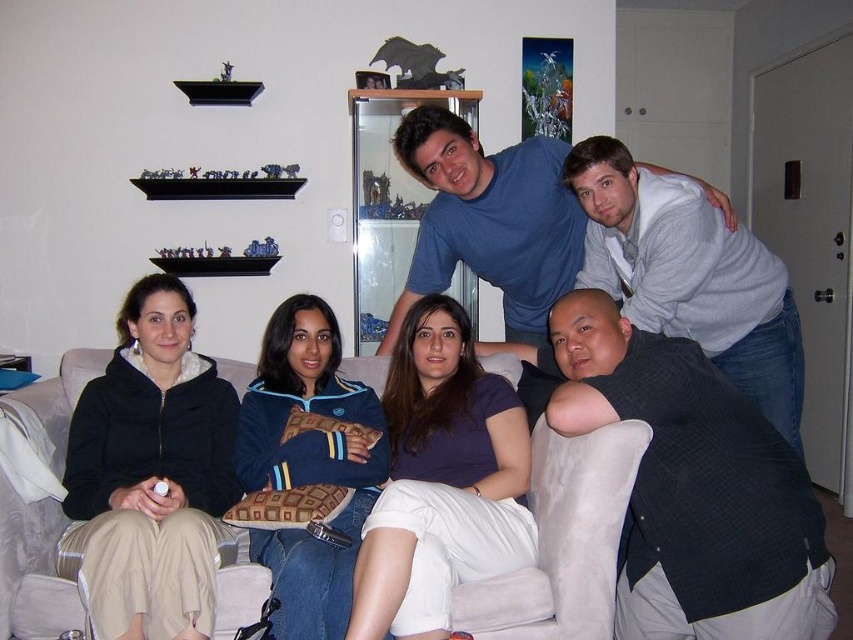
In the scene shown: What is the location of the point with coordinates (689, 275) in the image?

The point with coordinates (689, 275) is located on the gray sweater at upper right.

You are standing in the living room and want to take a photo of the two points. Which point, point (x=665, y=321) or point (x=431, y=260), will appear larger in the photo?

Point (x=665, y=321) will appear larger in the photo because it is closer to the camera than point (x=431, y=260).

You are organizing a clothing donation drive and need to determine which item is more suitable for a child. Based on the image, which item is smaller between the gray sweater at upper right and the blue cotton shirt at upper center?

The gray sweater at upper right is smaller than the blue cotton shirt at upper center, so it is more suitable for a child.